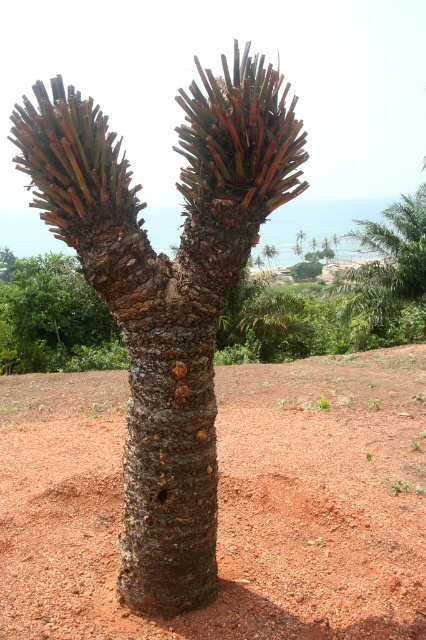
You are standing at the origin point in the image. Which direction should you move to reach the brown soil at center?

The brown soil at center is located at coordinates 0.787 on the x axis and 0.535 on the y axis. Since you are at the origin, you should move towards the positive x and y directions to reach it.

You are standing in front of the tree and want to place a small garden ornament on the ground near the brown rough bark tree at center. Considering the brown soil at center is in front of the tree, where should you place the ornament to ensure it is closest to the tree?

The brown soil at center is closer to the viewer than the brown rough bark tree at center, so placing the ornament on the soil near the base of the tree would position it closest to the tree.

You are a gardener who needs to plant a new shrub that requires at least 10 meters of space between it and the brown rough bark tree at center. You have a spot in mind at the brown soil at center. Is this location suitable?

The brown soil at center and brown rough bark tree at center are 11.41 meters apart from each other. Since the required distance is at least 10 meters, the location at the brown soil at center is suitable for planting the shrub.